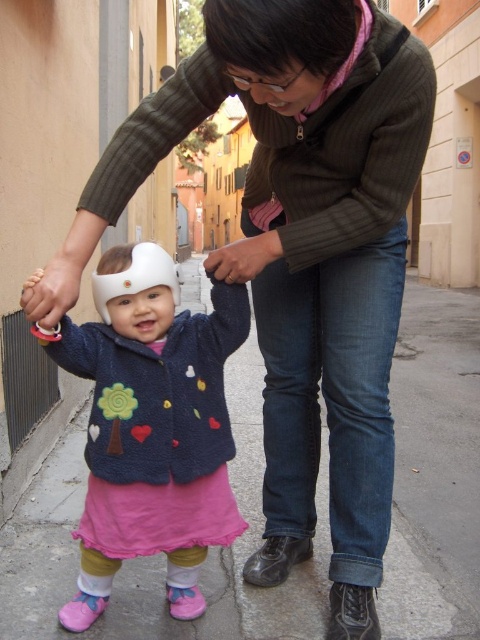
This screenshot has height=640, width=480. What do you see at coordinates (50, 292) in the screenshot?
I see `matte white helmet at upper left` at bounding box center [50, 292].

Which is behind, point (54, 308) or point (271, 237)?

The point (271, 237) is behind.

What do you see at coordinates (50, 292) in the screenshot? I see `matte white helmet at upper left` at bounding box center [50, 292].

Where is `matte white helmet at upper left`? Image resolution: width=480 pixels, height=640 pixels. matte white helmet at upper left is located at coordinates (50, 292).

You are a GUI agent. You are given a task and a screenshot of the screen. Output one action in this format:
    pyautogui.click(x=<x>, y=<y>)
    Task: Click on the gray concrete pavement at lower center
    
    Given the screenshot: What is the action you would take?
    pyautogui.click(x=158, y=556)

Can you confirm if gray concrete pavement at lower center is shorter than matte brown hand at center?

Yes.

Who is more distant from viewer, (442, 305) or (260, 241)?

The point (442, 305) is more distant.

Where is `gray concrete pavement at lower center`? Image resolution: width=480 pixels, height=640 pixels. gray concrete pavement at lower center is located at coordinates (158, 556).

Based on the photo, measure the distance between point (x=477, y=520) and camera.

A distance of 2.32 meters exists between point (x=477, y=520) and camera.

Is gray concrete pavement at lower center above fuzzy blue jacket at center?

No, gray concrete pavement at lower center is not above fuzzy blue jacket at center.

This screenshot has height=640, width=480. Describe the element at coordinates (158, 556) in the screenshot. I see `gray concrete pavement at lower center` at that location.

Locate an element on the screen. gray concrete pavement at lower center is located at coordinates (158, 556).